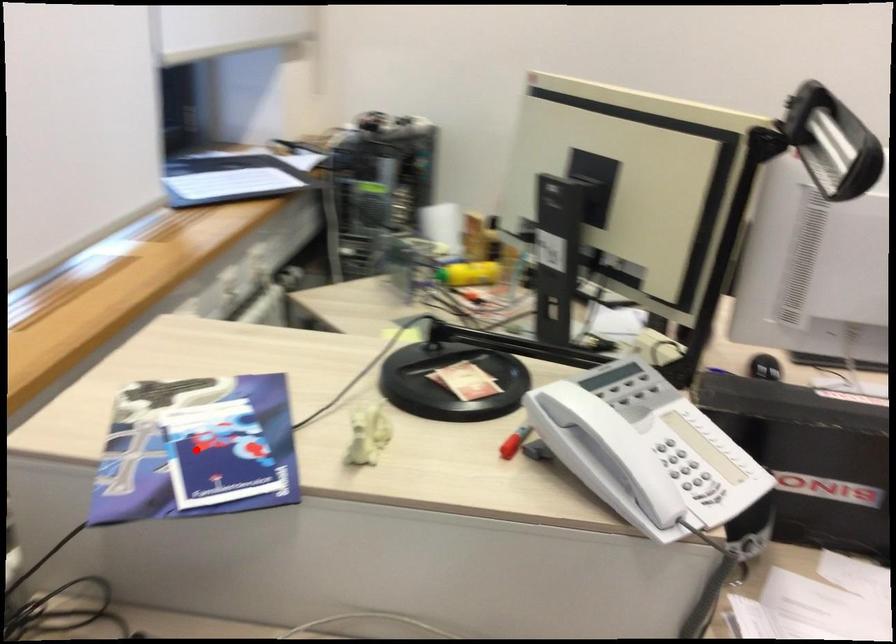
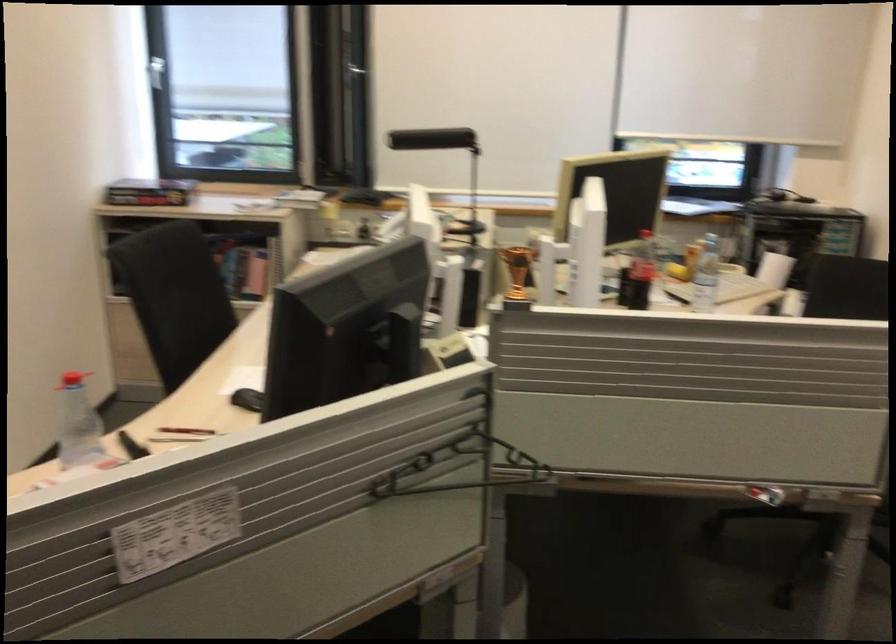
Question: I am providing you with two images of the same scene from different viewpoints. A red point is marked on the first image. Can you still see the location of the red point in image 2?

Choices:
 (A) Yes
 (B) No

Answer: (B)